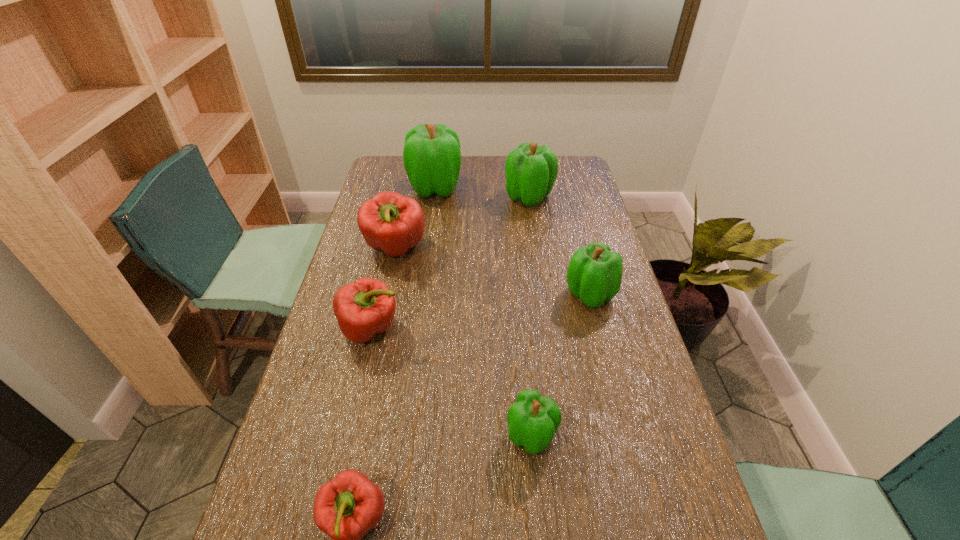
This screenshot has height=540, width=960. I want to click on vacant space located on the left of the third smallest green bell pepper, so click(x=473, y=197).

At what (x,y) coordinates should I click in order to perform the action: click on vacant space located 0.150m on the front of the biggest pink bell pepper. Please return your answer as a coordinate pair (x, y). This screenshot has width=960, height=540. Looking at the image, I should click on (384, 305).

The height and width of the screenshot is (540, 960). Identify the location of vacant area located 0.340m on the front of the third biggest green bell pepper. (622, 421).

This screenshot has width=960, height=540. What are the coordinates of `vacant area situated on the right of the second biggest pink bell pepper` in the screenshot? It's located at (453, 328).

Identify the location of free space located on the right of the second nearest object. The image size is (960, 540). (592, 435).

Locate an element on the screen. object positioned at the far left corner is located at coordinates (432, 158).

I want to click on object situated at the far right corner, so click(x=531, y=170).

You are a GUI agent. You are given a task and a screenshot of the screen. Output one action in this format:
    pyautogui.click(x=<x>, y=<y>)
    Task: Click on the free spot at the far edge of the desktop
    
    Given the screenshot: What is the action you would take?
    pyautogui.click(x=480, y=156)

The image size is (960, 540). What are the coordinates of `vacant position at the left edge of the desktop` in the screenshot? It's located at pyautogui.click(x=352, y=259).

Where is `blank area at the right edge`? The height and width of the screenshot is (540, 960). blank area at the right edge is located at coordinates (561, 202).